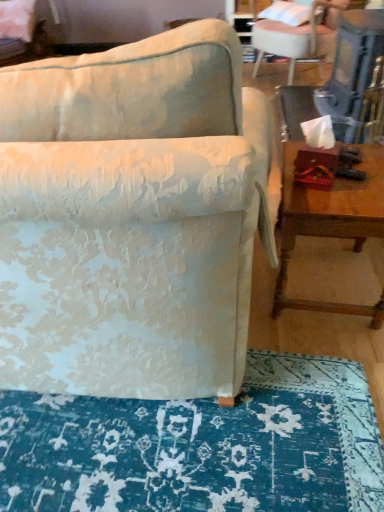
At what (x,y) coordinates should I click in order to perform the action: click on free spot above blue textured rug at lower center (from a real-world perspective). Please return your answer as a coordinate pair (x, y). The height and width of the screenshot is (512, 384). Looking at the image, I should click on [195, 433].